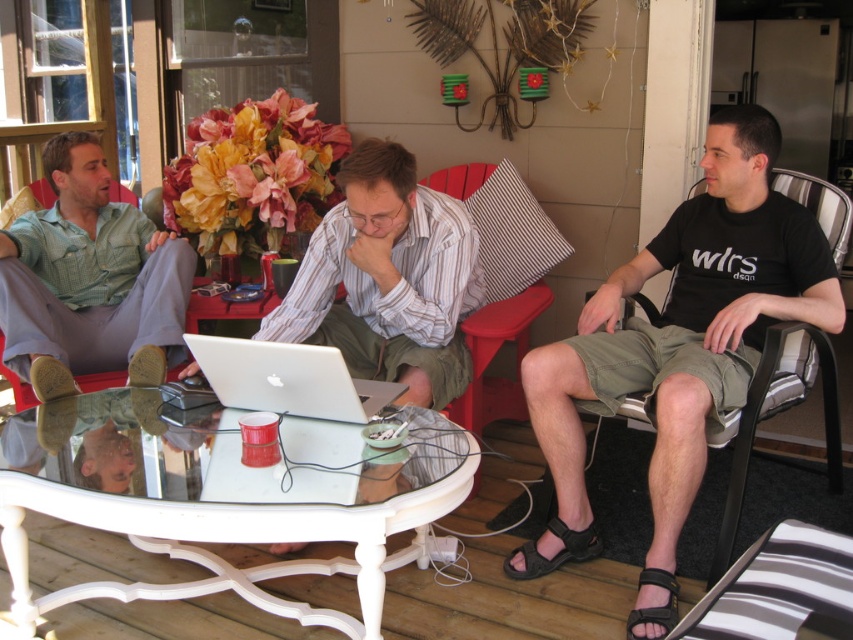
You are planning to place a new decorative item on the table. The item is larger than the silver metallic laptop at center but smaller than the red plastic chair at center. Where could you place it without moving any existing items?

Since the silver metallic laptop at center takes up less space than the red plastic chair at center, you can place the new decorative item in the remaining space around them on the table.